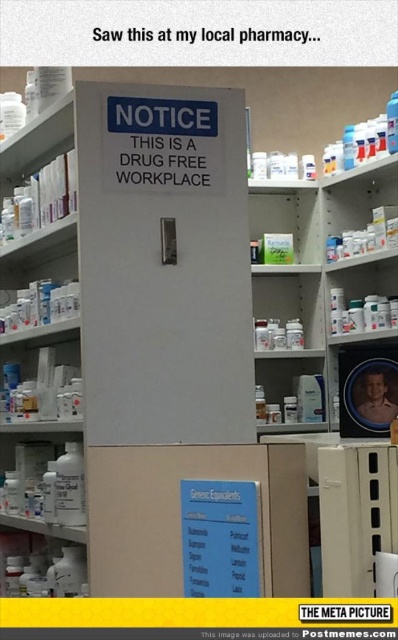
Between matte plastic shelf at center and white plastic bottle at lower left, which one appears on the left side from the viewer's perspective?

From the viewer's perspective, white plastic bottle at lower left appears more on the left side.

The height and width of the screenshot is (640, 398). What are the coordinates of `matte plastic shelf at center` in the screenshot? It's located at (282, 376).

Where is `matte plastic shelf at center`? This screenshot has width=398, height=640. matte plastic shelf at center is located at coordinates (282, 376).

Between white matte sign at center and white plastic bottle at lower left, which one is positioned higher?

white matte sign at center is higher up.

Where is `white matte sign at center`? white matte sign at center is located at coordinates (163, 264).

Does white plastic shelves at center appear under white plastic bottle at lower left?

Actually, white plastic shelves at center is above white plastic bottle at lower left.

Is white plastic shelves at center further to the viewer compared to white plastic bottle at lower left?

Yes, white plastic shelves at center is further from the viewer.

Between point (271, 301) and point (7, 458), which one is positioned in front?

Point (7, 458) is in front.

This screenshot has height=640, width=398. I want to click on white plastic shelves at center, so click(x=290, y=301).